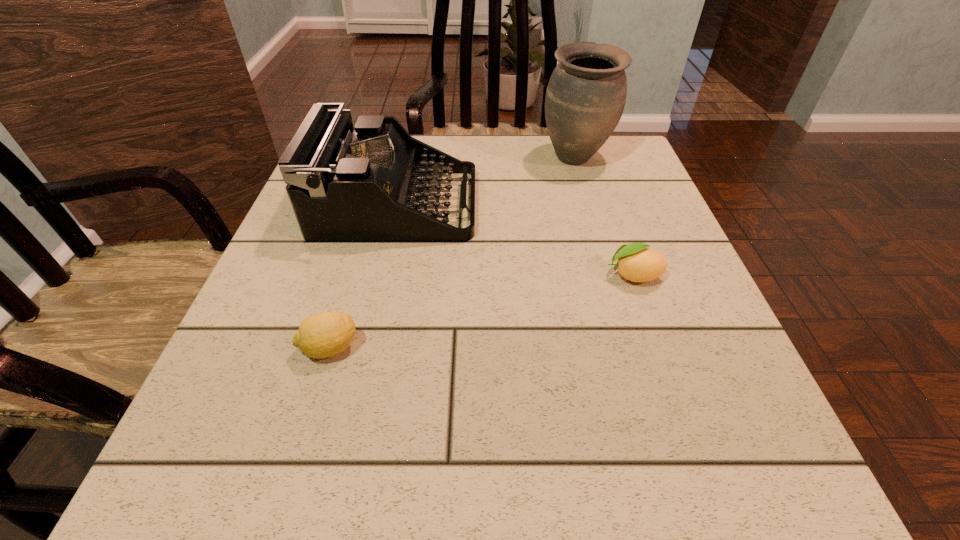
Identify the location of the tallest object. This screenshot has height=540, width=960. (585, 98).

Where is `the second tallest object`? the second tallest object is located at coordinates (366, 184).

You are a GUI agent. You are given a task and a screenshot of the screen. Output one action in this format:
    pyautogui.click(x=<x>, y=<y>)
    Task: Click on the second nearest object
    
    Given the screenshot: What is the action you would take?
    pyautogui.click(x=637, y=263)

The height and width of the screenshot is (540, 960). I want to click on the farther lemon, so click(637, 263).

I want to click on the nearest object, so click(x=323, y=335).

Find the location of a particular element. Image resolution: width=960 pixels, height=540 pixels. the left lemon is located at coordinates (323, 335).

Find the location of a particular element. Image resolution: width=960 pixels, height=540 pixels. free spot located on the front of the urn is located at coordinates (591, 214).

Where is `vacant space situated 0.230m on the typing side of the typewriter`? The height and width of the screenshot is (540, 960). vacant space situated 0.230m on the typing side of the typewriter is located at coordinates click(x=582, y=205).

At what (x,y) coordinates should I click in order to perform the action: click on free space located with leaves positioned above the second nearest object. Please return your answer as a coordinate pair (x, y). Looking at the image, I should click on (389, 275).

Find the location of a particular element. The image size is (960, 540). free location located with leaves positioned above the second nearest object is located at coordinates (516, 275).